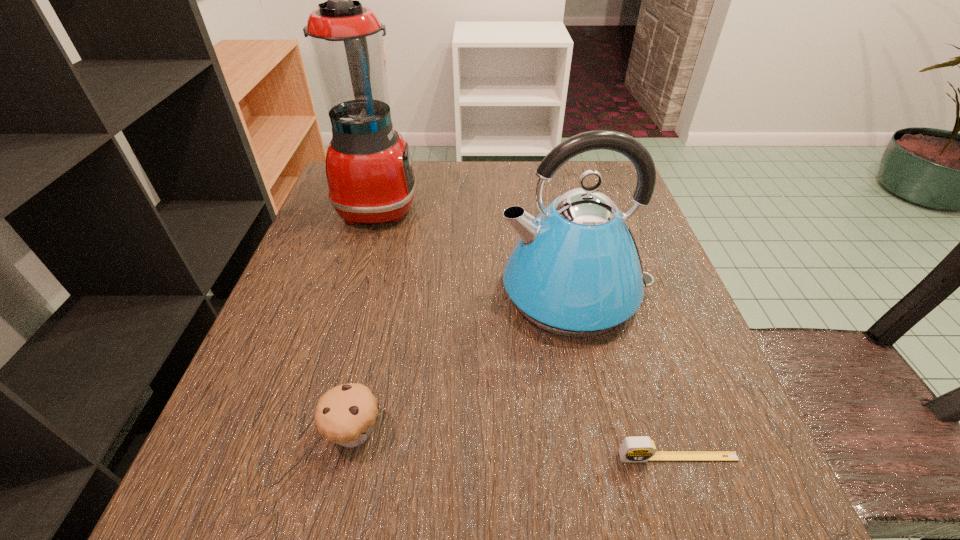
At what (x,y) coordinates should I click in order to perform the action: click on free space between the food processor and the third tallest object. Please return your answer as a coordinate pair (x, y). The height and width of the screenshot is (540, 960). Looking at the image, I should click on (366, 319).

In order to click on vacant point located between the food processor and the shortest object in this screenshot , I will do click(x=528, y=331).

The width and height of the screenshot is (960, 540). I want to click on free space between the muffin and the tallest object, so click(366, 319).

Where is `free space between the farthest object and the muffin`? The width and height of the screenshot is (960, 540). free space between the farthest object and the muffin is located at coordinates (366, 319).

Find the location of a particular element. Image resolution: width=960 pixels, height=540 pixels. empty space that is in between the kettle and the shortest object is located at coordinates (626, 374).

Find the location of a particular element. The width and height of the screenshot is (960, 540). free spot between the kettle and the muffin is located at coordinates (465, 362).

Identify the location of unoccupied area between the food processor and the muffin. The width and height of the screenshot is (960, 540). (366, 319).

Identify which object is the second closest to the second tallest object. Please provide its 2D coordinates. Your answer should be formatted as a tuple, i.e. [(x, y)], where the tuple contains the x and y coordinates of a point satisfying the conditions above.

[(369, 172)]

Locate an element on the screen. object that is the second closest to the kettle is located at coordinates (369, 172).

Locate an element on the screen. This screenshot has height=540, width=960. vacant space that satisfies the following two spatial constraints: 1. on the controls of the farthest object; 2. on the back side of the third tallest object is located at coordinates (310, 432).